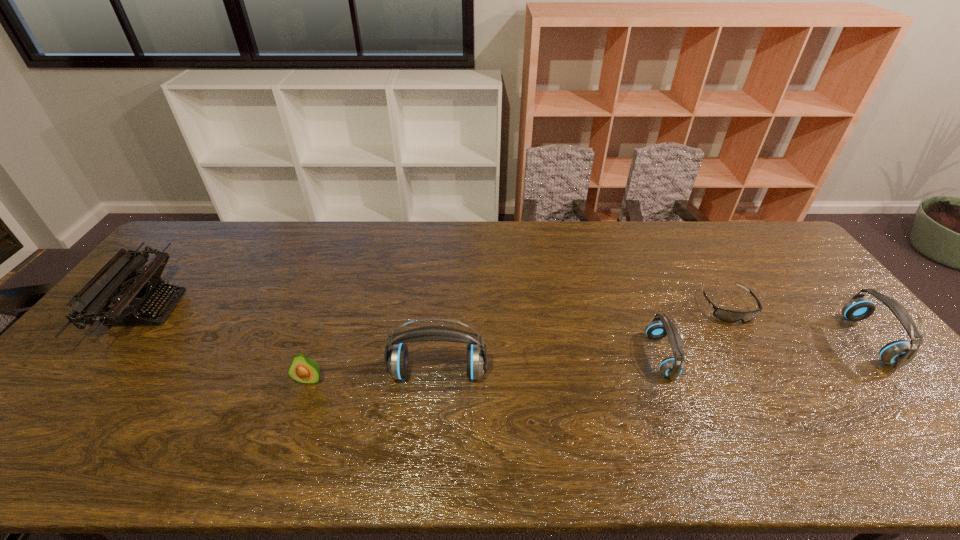
Identify the location of vacant area at the near edge. This screenshot has width=960, height=540. (586, 399).

The image size is (960, 540). What are the coordinates of `vacant space at the right edge of the desktop` in the screenshot? It's located at (902, 382).

The image size is (960, 540). In the image, there is a desktop. Identify the location of free space at the far right corner. (761, 232).

The image size is (960, 540). In the image, there is a desktop. Identify the location of vacant space at the near right corner. (875, 408).

Locate an element on the screen. This screenshot has height=540, width=960. empty space between the rightmost object and the typewriter is located at coordinates (508, 325).

Where is `empty space between the second object from left to right and the typewriter`? empty space between the second object from left to right and the typewriter is located at coordinates (228, 344).

Identify the location of vacant area that lies between the second object from right to left and the leftmost headset. (583, 340).

This screenshot has width=960, height=540. Find the location of `free space between the tallest headset and the second headset from right to left`. free space between the tallest headset and the second headset from right to left is located at coordinates (549, 364).

Locate an element on the screen. The width and height of the screenshot is (960, 540). free space between the second headset from right to left and the second tallest headset is located at coordinates (765, 348).

This screenshot has height=540, width=960. Identify the location of unoccupied position between the shortest object and the rightmost object. (798, 323).